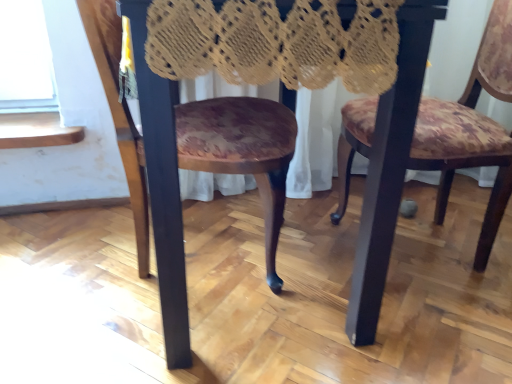
At what (x,y) coordinates should I click in order to perform the action: click on free space in front of wooden floral-patterned chair at center, which is the second chair from right to left. Please return your answer as a coordinate pair (x, y). Looking at the image, I should click on (141, 341).